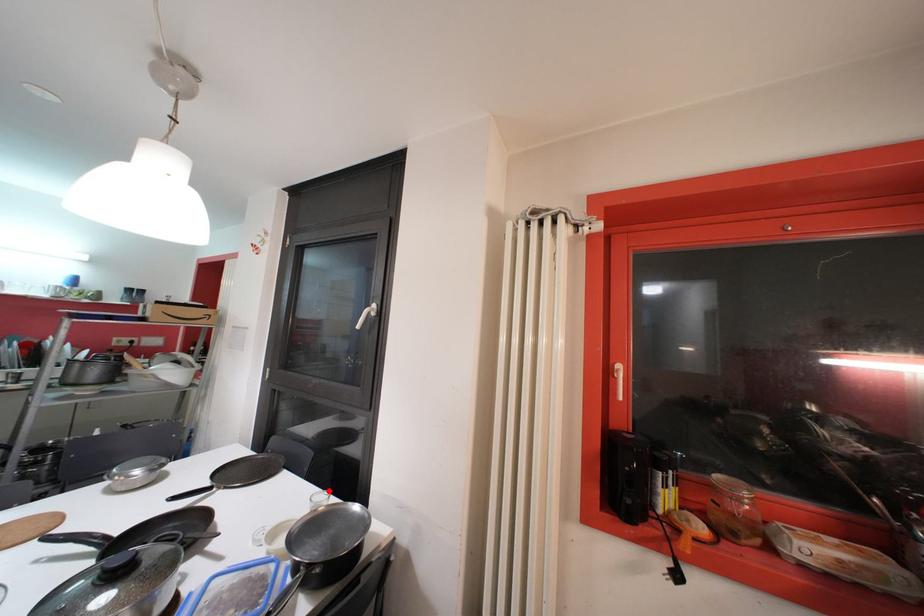
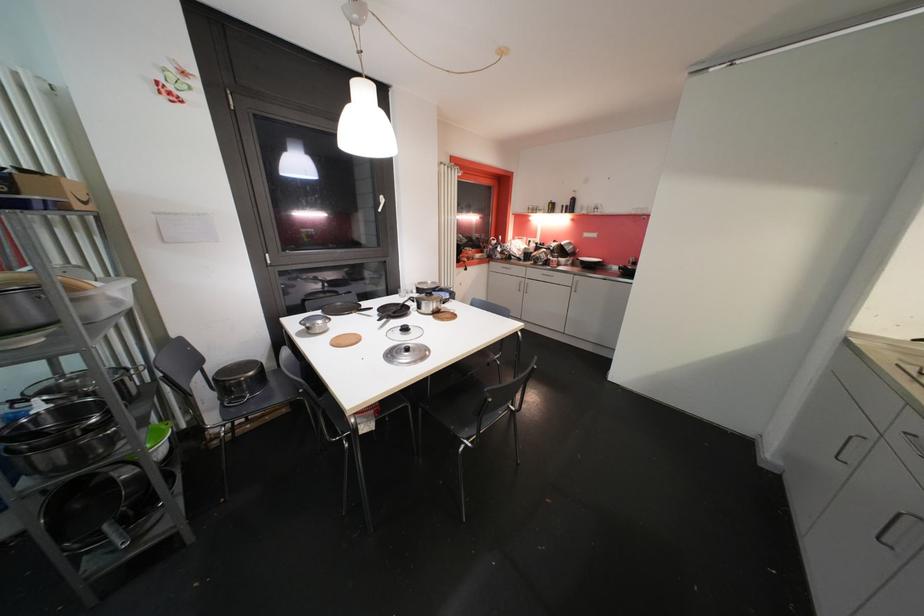
Question: I am providing you with two images of the same scene from different viewpoints. A red point is marked on the first image. At the location where the point appears in image 1, is it still visible in image 2?

Choices:
 (A) Yes
 (B) No

Answer: (B)